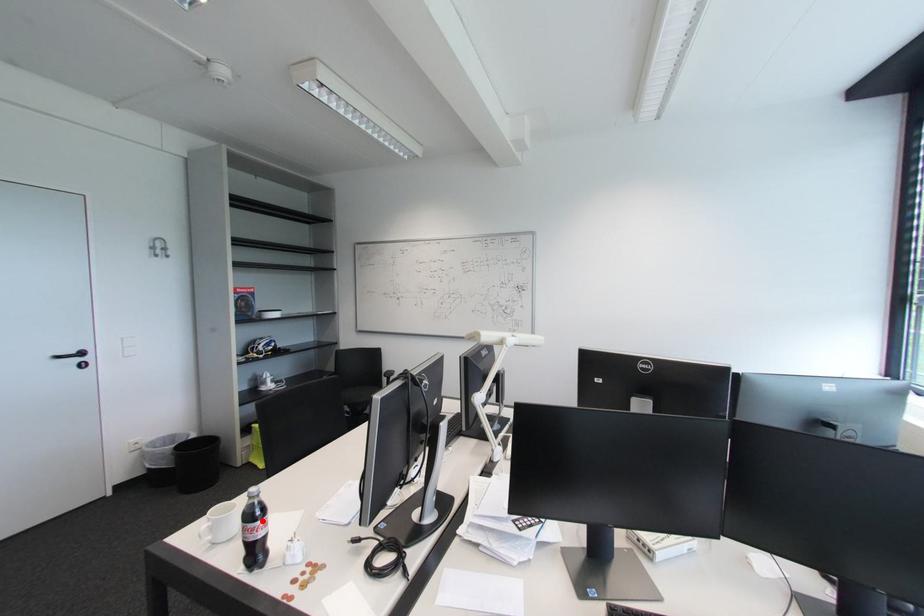
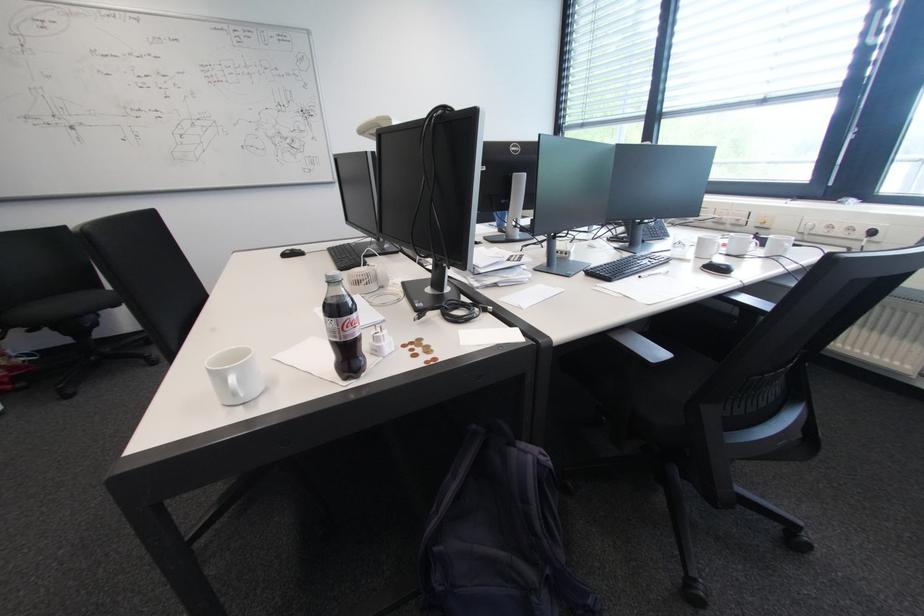
Question: I am providing you with two images of the same scene from different viewpoints. Image1 has a red point marked. In image2, the corresponding 3D location appears at what relative position? Reply with the corresponding letter.

Choices:
 (A) Closer
 (B) Farther

Answer: (A)